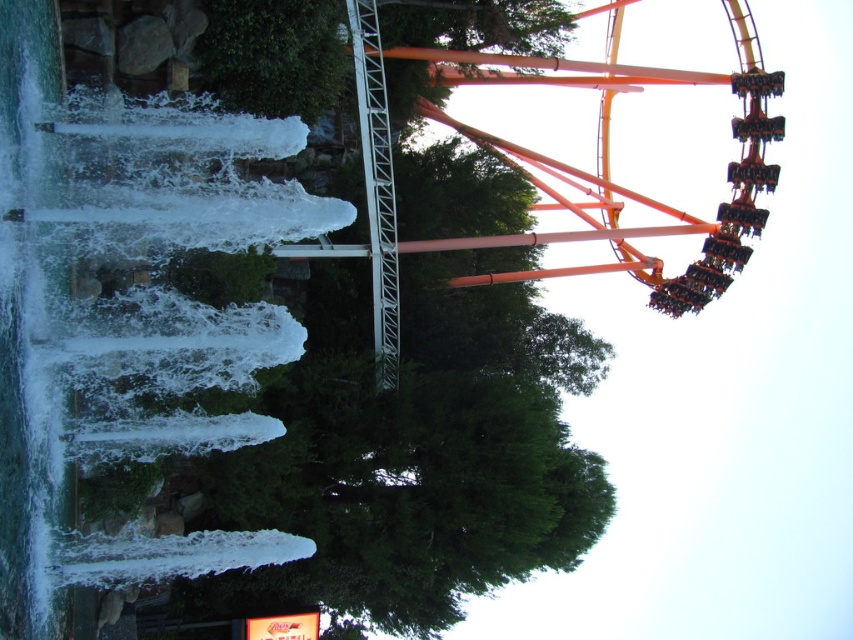
Question: Can you confirm if green leafy tree at center is thinner than orange metallic roller coaster at upper right?

Choices:
 (A) yes
 (B) no

Answer: (B)

Question: Is the position of green leafy tree at center more distant than that of orange metallic roller coaster at upper right?

Choices:
 (A) yes
 (B) no

Answer: (B)

Question: Is green leafy tree at center wider than orange metallic roller coaster at upper right?

Choices:
 (A) no
 (B) yes

Answer: (B)